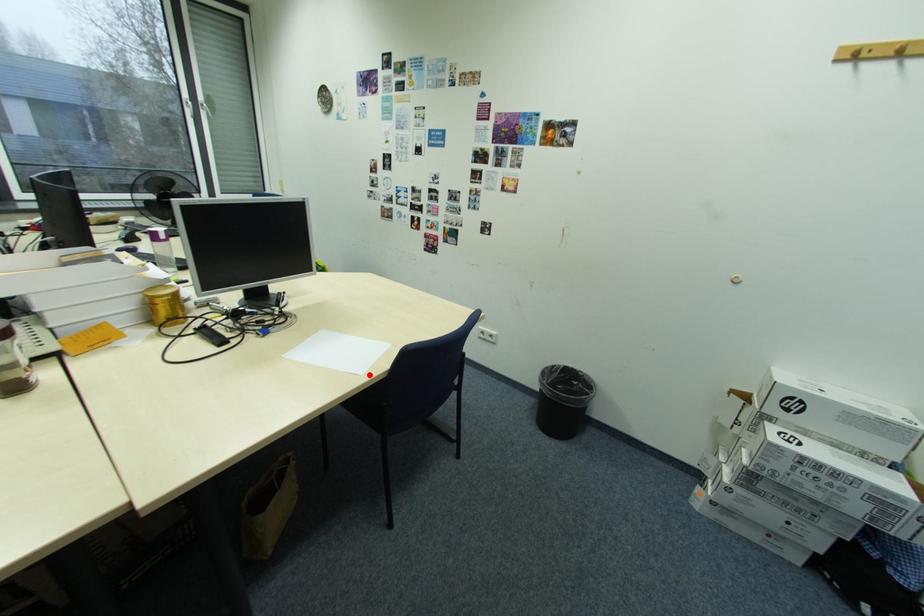
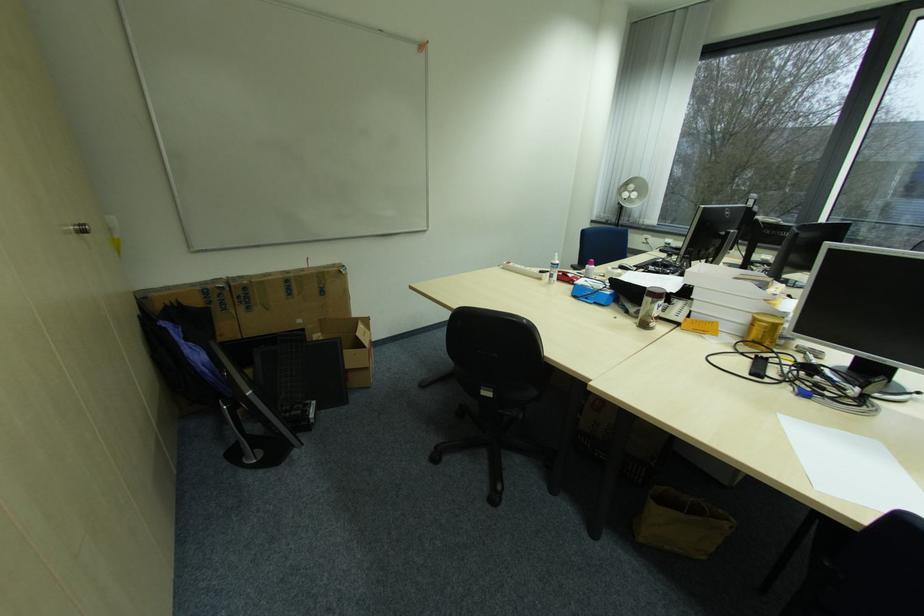
Find the pixel in the second image that matches the highlighted location in the first image.

(824, 488)